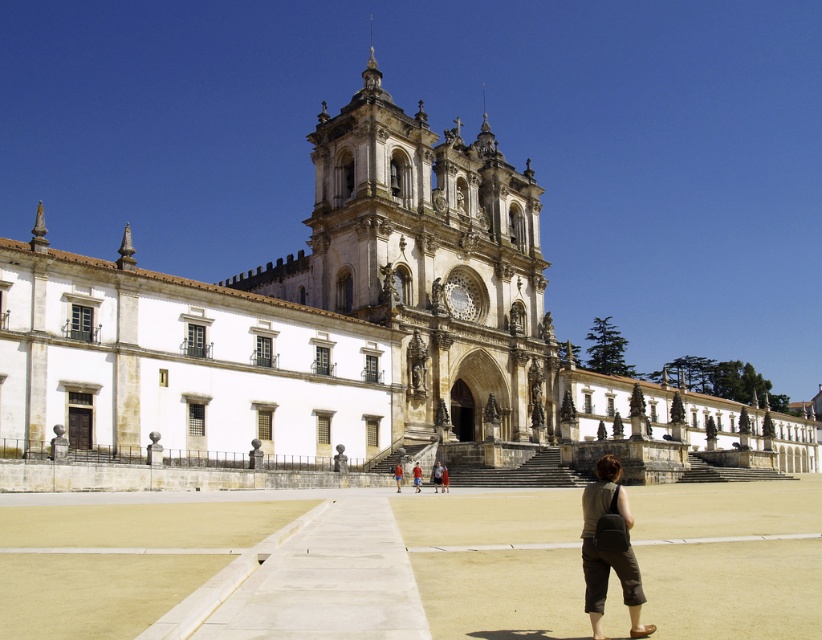
Consider the image. Which of these two, white stone church at center or brown fabric pants at lower center, stands shorter?

With less height is brown fabric pants at lower center.

Does white stone church at center have a greater width compared to brown fabric pants at lower center?

Correct, the width of white stone church at center exceeds that of brown fabric pants at lower center.

Image resolution: width=822 pixels, height=640 pixels. What do you see at coordinates (440, 134) in the screenshot?
I see `white stone church at center` at bounding box center [440, 134].

You are a GUI agent. You are given a task and a screenshot of the screen. Output one action in this format:
    pyautogui.click(x=<x>, y=<y>)
    Task: Click on the white stone church at center
    The height and width of the screenshot is (640, 822).
    Given the screenshot: What is the action you would take?
    pyautogui.click(x=440, y=134)

What do you see at coordinates (428, 268) in the screenshot? This screenshot has width=822, height=640. I see `white stone tower at center` at bounding box center [428, 268].

Is point (500, 336) positioned behind point (599, 502)?

Yes.

Does point (298, 260) lie behind point (629, 573)?

That is True.

Find the location of a particular element. This screenshot has height=640, width=822. white stone tower at center is located at coordinates (428, 268).

Is point (398, 490) positioned in front of point (414, 474)?

Yes, point (398, 490) is in front of point (414, 474).

Identify the location of red shirt at center. The image size is (822, 640). (398, 474).

Between point (396, 467) and point (414, 476), which one is positioned in front?

Point (414, 476) is in front.

Locate an element on the screen. red shirt at center is located at coordinates (398, 474).